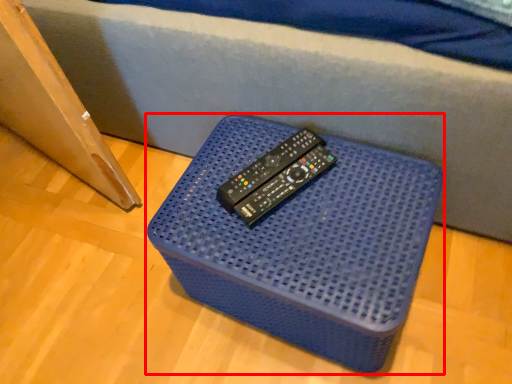
Question: From the image, what is the correct spatial relationship of furniture (annotated by the red box) in relation to remote?

Choices:
 (A) left
 (B) right

Answer: (B)